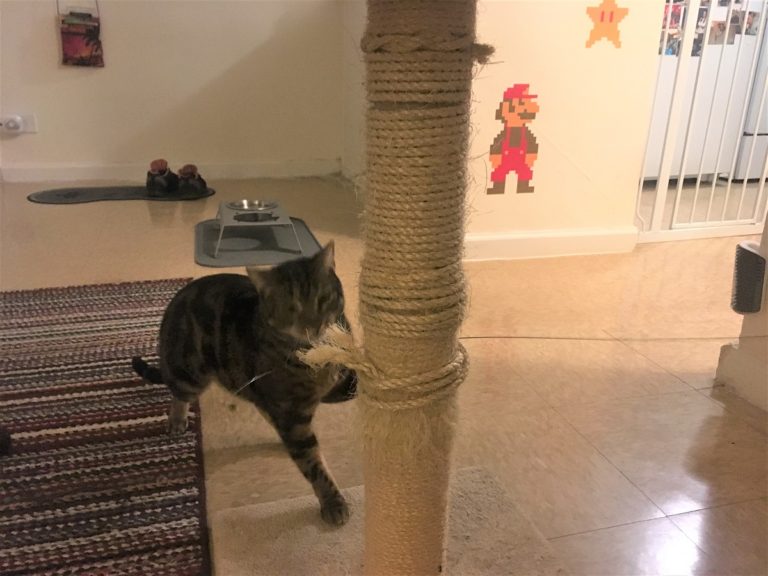
Locate an element on the screen. This screenshot has height=576, width=768. floor mat is located at coordinates (124, 194), (257, 245).